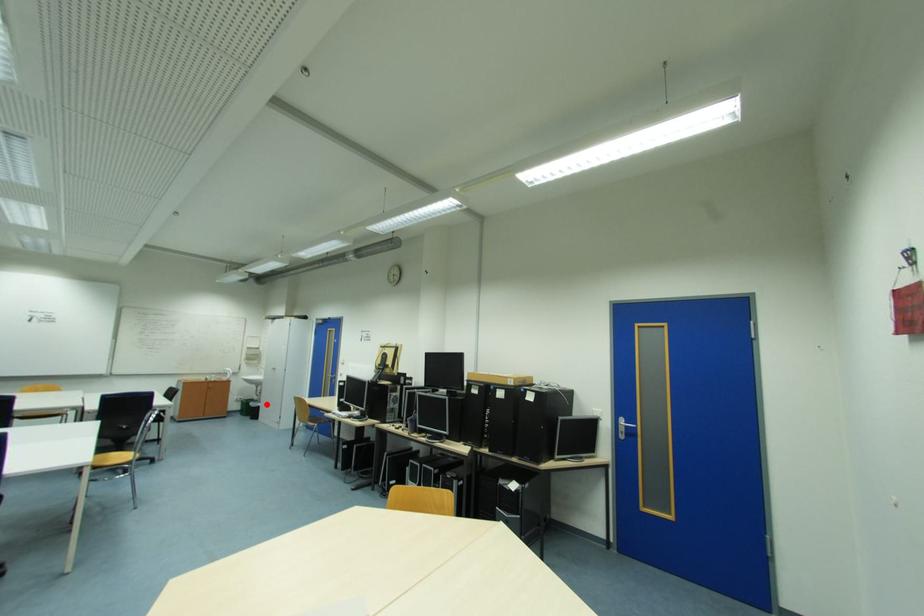
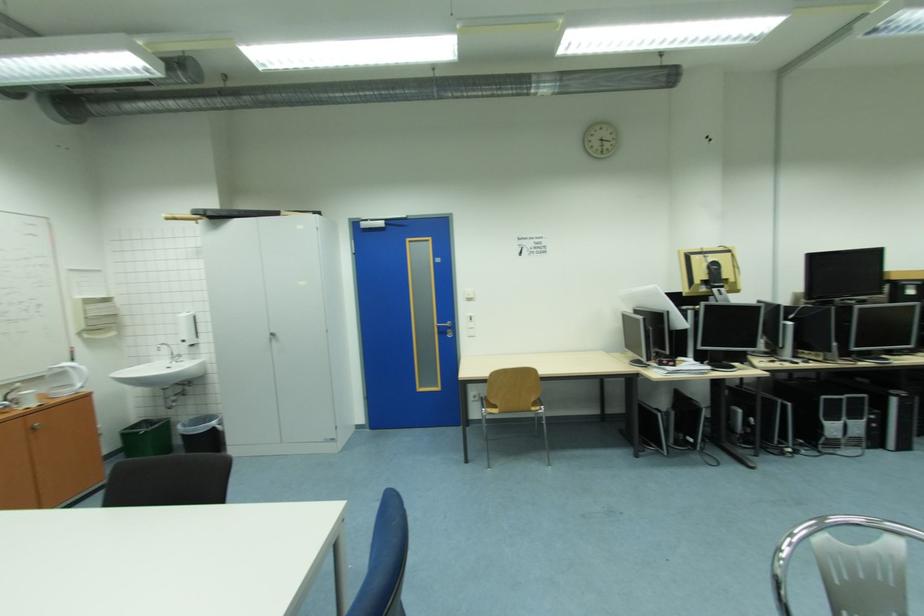
Question: A red point is marked in image1. In image2, is the corresponding 3D point closer to the camera or farther? Reply with the corresponding letter.

Choices:
 (A) The corresponding 3D point is closer.
 (B) The corresponding 3D point is farther.

Answer: (A)